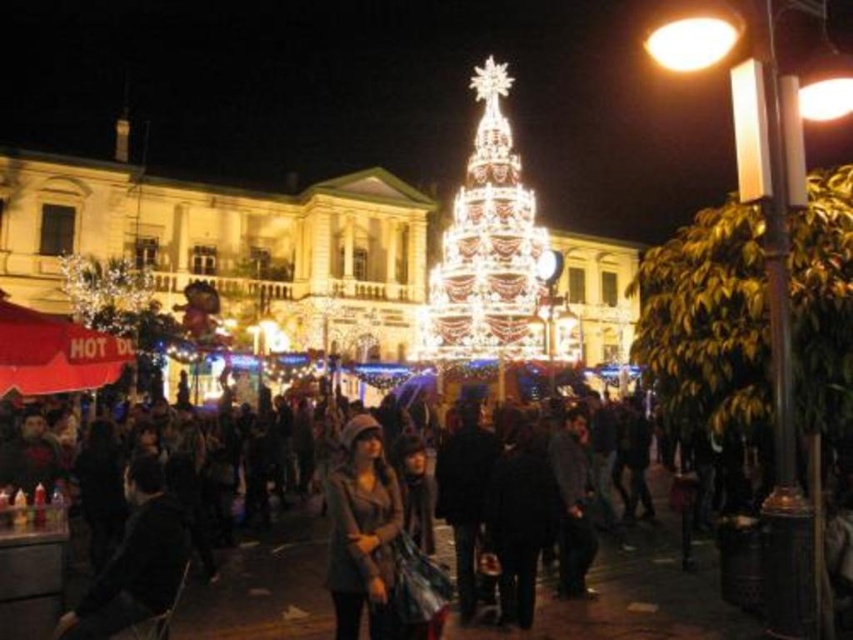
Question: Does dark gray coat at center have a greater width compared to matte gray coat at center?

Choices:
 (A) yes
 (B) no

Answer: (A)

Question: Among these points, which one is nearest to the camera?

Choices:
 (A) (347, 484)
 (B) (279, 627)

Answer: (B)

Question: Which of the following is the farthest from the observer?

Choices:
 (A) (482, 353)
 (B) (334, 563)

Answer: (A)

Question: Is dark gray coat at center closer to camera compared to illuminated glass christmas tree at center?

Choices:
 (A) yes
 (B) no

Answer: (A)

Question: Which is farther from the dark gray coat at center?

Choices:
 (A) matte gray coat at center
 (B) illuminated glass christmas tree at center

Answer: (B)

Question: Observing the image, what is the correct spatial positioning of dark gray coat at center in reference to illuminated glass christmas tree at center?

Choices:
 (A) left
 (B) right

Answer: (A)